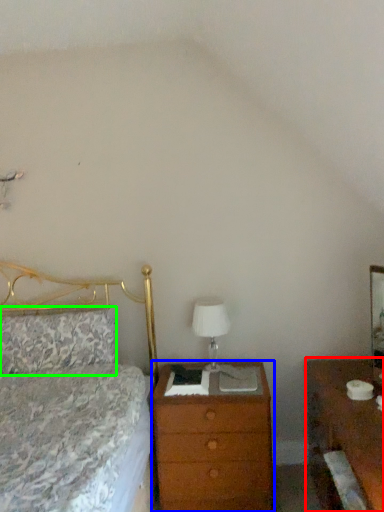
Question: Which is nearer to the nightstand (highlighted by a red box)? chest of drawers (highlighted by a blue box) or pillow (highlighted by a green box).

Choices:
 (A) chest of drawers
 (B) pillow

Answer: (A)